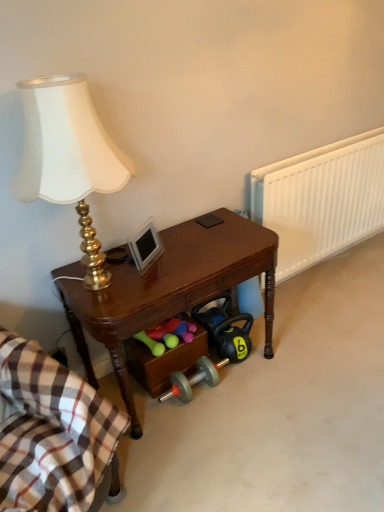
Where is `plaid cotton blanket at lower left`? This screenshot has height=512, width=384. plaid cotton blanket at lower left is located at coordinates (51, 432).

Describe the element at coordinates (170, 289) in the screenshot. I see `shiny brown desk at center` at that location.

What is the approximate width of shiny brown desk at center?

shiny brown desk at center is 18.65 inches wide.

The width and height of the screenshot is (384, 512). In order to click on white plastic radiator at right in this screenshot , I will do `click(321, 200)`.

What do you see at coordinates (164, 361) in the screenshot? The width and height of the screenshot is (384, 512). I see `wooden drawer at lower center` at bounding box center [164, 361].

This screenshot has width=384, height=512. What do you see at coordinates (69, 157) in the screenshot?
I see `gold metallic lamp at left` at bounding box center [69, 157].

This screenshot has width=384, height=512. What are the coordinates of `rubberized green dumbbells at lower center` in the screenshot? It's located at (167, 334).

How different are the orientations of rubberized green dumbbells at lower center and plaid cotton blanket at lower left in degrees?

The facing directions of rubberized green dumbbells at lower center and plaid cotton blanket at lower left are 29 degrees apart.

Visually, is rubberized green dumbbells at lower center positioned to the left or to the right of plaid cotton blanket at lower left?

In the image, rubberized green dumbbells at lower center appears on the right side of plaid cotton blanket at lower left.

Between rubberized green dumbbells at lower center and plaid cotton blanket at lower left, which one has larger size?

plaid cotton blanket at lower left.

Based on the photo, from a real-world perspective, which object rests below the other?

rubberized green dumbbells at lower center, from a real-world perspective.

Considering the relative sizes of rubberized green dumbbells at lower center and gold metallic lamp at left in the image provided, is rubberized green dumbbells at lower center bigger than gold metallic lamp at left?

No, rubberized green dumbbells at lower center is not bigger than gold metallic lamp at left.

Is rubberized green dumbbells at lower center positioned far away from gold metallic lamp at left?

They are positioned close to each other.

Is rubberized green dumbbells at lower center facing away from gold metallic lamp at left?

That's not correct — rubberized green dumbbells at lower center is not looking away from gold metallic lamp at left.

Is gold metallic lamp at left located within rubberized green dumbbells at lower center?

No, rubberized green dumbbells at lower center does not contain gold metallic lamp at left.

Considering the sizes of objects shiny brown desk at center and rubberized green dumbbells at lower center in the image provided, who is thinner, shiny brown desk at center or rubberized green dumbbells at lower center?

rubberized green dumbbells at lower center.

Based on the photo, from their relative heights in the image, would you say shiny brown desk at center is taller or shorter than rubberized green dumbbells at lower center?

Considering their sizes, shiny brown desk at center has more height than rubberized green dumbbells at lower center.

Where is `desk above the rubberized green dumbbells at lower center (from a real-world perspective)`? This screenshot has height=512, width=384. desk above the rubberized green dumbbells at lower center (from a real-world perspective) is located at coordinates (170, 289).

Is point (214, 293) farther from camera compared to point (177, 323)?

No, it is not.

Considering the positions of objects gold metallic lamp at left and wooden drawer at lower center in the image provided, who is more to the left, gold metallic lamp at left or wooden drawer at lower center?

gold metallic lamp at left is more to the left.

Based on the photo, based on their sizes in the image, would you say gold metallic lamp at left is bigger or smaller than wooden drawer at lower center?

In the image, gold metallic lamp at left appears to be larger than wooden drawer at lower center.

In the scene shown: Which is less distant, (x=31, y=151) or (x=158, y=391)?

The point (x=31, y=151) is closer.

What's the angular difference between gold metallic lamp at left and wooden drawer at lower center's facing directions?

gold metallic lamp at left and wooden drawer at lower center are facing 2.18 degrees away from each other.

Is white plastic radiator at right inside the boundaries of plaid cotton blanket at lower left, or outside?

white plastic radiator at right is not inside plaid cotton blanket at lower left, it's outside.

Where is `blanket in front of the white plastic radiator at right`? blanket in front of the white plastic radiator at right is located at coordinates (51, 432).

How many degrees apart are the facing directions of white plastic radiator at right and plaid cotton blanket at lower left?

white plastic radiator at right and plaid cotton blanket at lower left are facing 28.7 degrees away from each other.

From a real-world perspective, which is physically above, white plastic radiator at right or plaid cotton blanket at lower left?

white plastic radiator at right.

Based on the photo, which object is wider, white plastic radiator at right or wooden drawer at lower center?

With larger width is wooden drawer at lower center.

Is white plastic radiator at right touching wooden drawer at lower center?

white plastic radiator at right is not next to wooden drawer at lower center, and they're not touching.

Does white plastic radiator at right lie behind wooden drawer at lower center?

Yes, the depth of white plastic radiator at right is greater than that of wooden drawer at lower center.

Looking at this image, is white plastic radiator at right oriented away from wooden drawer at lower center?

white plastic radiator at right is not turned away from wooden drawer at lower center.

Considering the relative sizes of rubberized green dumbbells at lower center and wooden drawer at lower center in the image provided, is rubberized green dumbbells at lower center thinner than wooden drawer at lower center?

Yes.

Which is closer, [187,326] or [131,340]?

The point [131,340] is closer to the camera.

From their relative heights in the image, would you say rubberized green dumbbells at lower center is taller or shorter than wooden drawer at lower center?

rubberized green dumbbells at lower center is shorter than wooden drawer at lower center.

Which object is positioned more to the right, rubberized green dumbbells at lower center or wooden drawer at lower center?

From the viewer's perspective, wooden drawer at lower center appears more on the right side.

Where is `blanket on the left of rubberized green dumbbells at lower center`? The height and width of the screenshot is (512, 384). blanket on the left of rubberized green dumbbells at lower center is located at coordinates (51, 432).

Find the location of a particular element. This screenshot has height=512, width=384. stuff on the right side of gold metallic lamp at left is located at coordinates (167, 334).

From the image, which object appears to be farther from rubberized green dumbbells at lower center, wooden drawer at lower center or gold metallic lamp at left?

The object further to rubberized green dumbbells at lower center is gold metallic lamp at left.

Looking at the image, which one is located closer to gold metallic lamp at left, rubberized green dumbbells at lower center or wooden drawer at lower center?

The object closer to gold metallic lamp at left is rubberized green dumbbells at lower center.

Considering their positions, is plaid cotton blanket at lower left positioned closer to rubberized green dumbbells at lower center than gold metallic lamp at left?

Based on the image, plaid cotton blanket at lower left appears to be nearer to rubberized green dumbbells at lower center.

Based on their spatial positions, is plaid cotton blanket at lower left or shiny brown desk at center further from gold metallic lamp at left?

Based on the image, plaid cotton blanket at lower left appears to be further to gold metallic lamp at left.

Looking at this image, estimate the real-world distances between objects in this image. Which object is further from wooden drawer at lower center, plaid cotton blanket at lower left or rubberized green dumbbells at lower center?

Based on the image, plaid cotton blanket at lower left appears to be further to wooden drawer at lower center.

Looking at the image, which one is located further to plaid cotton blanket at lower left, wooden drawer at lower center or gold metallic lamp at left?

gold metallic lamp at left is positioned further to the anchor plaid cotton blanket at lower left.

Based on their spatial positions, is shiny brown desk at center or gold metallic lamp at left closer to plaid cotton blanket at lower left?

shiny brown desk at center.

Considering their positions, is wooden drawer at lower center positioned further to shiny brown desk at center than gold metallic lamp at left?

Among the two, gold metallic lamp at left is located further to shiny brown desk at center.

Find the location of a particular element. drawer between plaid cotton blanket at lower left and white plastic radiator at right in the horizontal direction is located at coordinates (164, 361).

You are a GUI agent. You are given a task and a screenshot of the screen. Output one action in this format:
    pyautogui.click(x=<x>, y=<y>)
    Task: Click on the lamp located between plaid cotton blanket at lower left and rubberized green dumbbells at lower center in the depth direction
    The width and height of the screenshot is (384, 512).
    Given the screenshot: What is the action you would take?
    pyautogui.click(x=69, y=157)

Identify the location of desk between rubberized green dumbbells at lower center and white plastic radiator at right from left to right. (170, 289).

What are the coordinates of `lamp situated between plaid cotton blanket at lower left and white plastic radiator at right from left to right` in the screenshot? It's located at (69, 157).